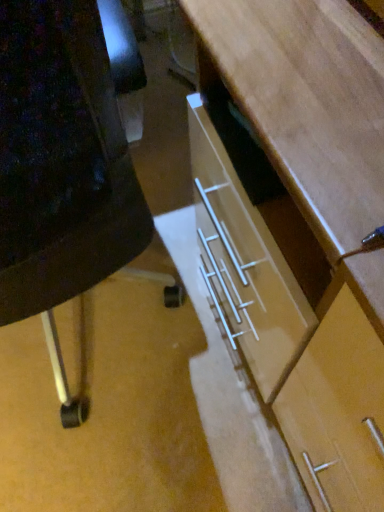
Question: Considering the positions of white plastic drawer at lower center and wooden desk at center in the image, is white plastic drawer at lower center taller or shorter than wooden desk at center?

Choices:
 (A) tall
 (B) short

Answer: (A)

Question: Considering the relative positions of white plastic drawer at lower center and wooden desk at center in the image provided, is white plastic drawer at lower center to the left or to the right of wooden desk at center?

Choices:
 (A) left
 (B) right

Answer: (A)

Question: From the image's perspective, is white plastic drawer at lower center located above or below wooden desk at center?

Choices:
 (A) above
 (B) below

Answer: (B)

Question: Is wooden desk at center wider or thinner than white plastic drawer at lower center?

Choices:
 (A) thin
 (B) wide

Answer: (B)

Question: Looking at the image, does wooden desk at center seem bigger or smaller compared to white plastic drawer at lower center?

Choices:
 (A) big
 (B) small

Answer: (B)

Question: From the image's perspective, is wooden desk at center positioned above or below white plastic drawer at lower center?

Choices:
 (A) above
 (B) below

Answer: (A)

Question: From a real-world perspective, relative to white plastic drawer at lower center, is wooden desk at center vertically above or below?

Choices:
 (A) above
 (B) below

Answer: (B)